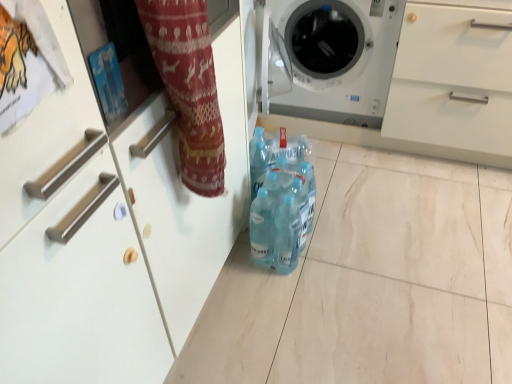
Find the location of a particular element. The height and width of the screenshot is (384, 512). white glossy washing machine at center is located at coordinates (332, 59).

What do you see at coordinates (332, 59) in the screenshot?
I see `white glossy washing machine at center` at bounding box center [332, 59].

What is the approximate height of white glossy washing machine at center?

The height of white glossy washing machine at center is 27.57 inches.

Measure the distance between white glossy washing machine at center and camera.

4.86 feet.

The height and width of the screenshot is (384, 512). What do you see at coordinates (282, 202) in the screenshot?
I see `blue plastic bottles at center` at bounding box center [282, 202].

Identify the location of blue plastic bottles at center. The width and height of the screenshot is (512, 384). (282, 202).

The width and height of the screenshot is (512, 384). What are the coordinates of `white glossy washing machine at center` in the screenshot? It's located at (332, 59).

Between white glossy washing machine at center and blue plastic bottles at center, which one appears on the left side from the viewer's perspective?

blue plastic bottles at center.

Between white glossy washing machine at center and blue plastic bottles at center, which one is positioned behind?

Positioned behind is white glossy washing machine at center.

Between point (297, 102) and point (273, 233), which one is positioned in front?

The point (273, 233) is closer to the camera.

From the image's perspective, is white glossy washing machine at center under blue plastic bottles at center?

No, from the image's perspective, white glossy washing machine at center is not below blue plastic bottles at center.

From a real-world perspective, is white glossy washing machine at center physically above blue plastic bottles at center?

Indeed, from a real-world perspective, white glossy washing machine at center stands above blue plastic bottles at center.

In the scene shown: Which object is thinner, white glossy washing machine at center or blue plastic bottles at center?

blue plastic bottles at center is thinner.

In terms of height, does white glossy washing machine at center look taller or shorter compared to blue plastic bottles at center?

Considering their sizes, white glossy washing machine at center has more height than blue plastic bottles at center.

Consider the image. Considering the sizes of objects white glossy washing machine at center and blue plastic bottles at center in the image provided, who is smaller, white glossy washing machine at center or blue plastic bottles at center?

blue plastic bottles at center.

Could blue plastic bottles at center be considered to be inside white glossy washing machine at center?

Definitely not — blue plastic bottles at center is not inside white glossy washing machine at center.

Is white glossy washing machine at center beside blue plastic bottles at center?

No, white glossy washing machine at center is not next to blue plastic bottles at center.

Is blue plastic bottles at center at the back of white glossy washing machine at center?

No, white glossy washing machine at center is not facing the opposite direction of blue plastic bottles at center.

How different are the orientations of white glossy washing machine at center and blue plastic bottles at center in degrees?

The angle between the facing direction of white glossy washing machine at center and the facing direction of blue plastic bottles at center is 85.5 degrees.

At what (x,y) coordinates should I click in order to perform the action: click on cleaning product in front of the white glossy washing machine at center. Please return your answer as a coordinate pair (x, y). This screenshot has width=512, height=384. Looking at the image, I should click on (282, 202).

Considering the positions of objects blue plastic bottles at center and white glossy washing machine at center in the image provided, who is more to the left, blue plastic bottles at center or white glossy washing machine at center?

Positioned to the left is blue plastic bottles at center.

Looking at this image, relative to white glossy washing machine at center, is blue plastic bottles at center in front or behind?

blue plastic bottles at center is positioned closer to the viewer than white glossy washing machine at center.

Is point (290, 254) in front of point (383, 42)?

Yes, it is.

From the image's perspective, would you say blue plastic bottles at center is shown under white glossy washing machine at center?

Yes, from the image's perspective, blue plastic bottles at center is beneath white glossy washing machine at center.

From a real-world perspective, is blue plastic bottles at center over white glossy washing machine at center?

No.

Considering the sizes of objects blue plastic bottles at center and white glossy washing machine at center in the image provided, who is thinner, blue plastic bottles at center or white glossy washing machine at center?

With smaller width is blue plastic bottles at center.

Considering the relative sizes of blue plastic bottles at center and white glossy washing machine at center in the image provided, is blue plastic bottles at center taller than white glossy washing machine at center?

No, blue plastic bottles at center is not taller than white glossy washing machine at center.

Which of these two, blue plastic bottles at center or white glossy washing machine at center, is smaller?

blue plastic bottles at center is smaller.

Is blue plastic bottles at center inside or outside of white glossy washing machine at center?

blue plastic bottles at center is not enclosed by white glossy washing machine at center.

Is blue plastic bottles at center next to white glossy washing machine at center?

blue plastic bottles at center is not next to white glossy washing machine at center, and they're not touching.

Is blue plastic bottles at center oriented towards white glossy washing machine at center?

No, blue plastic bottles at center is not turned towards white glossy washing machine at center.

How far apart are blue plastic bottles at center and white glossy washing machine at center?

blue plastic bottles at center is 18.51 inches from white glossy washing machine at center.

Find the location of `cleaning product on the left of white glossy washing machine at center`. cleaning product on the left of white glossy washing machine at center is located at coordinates (282, 202).

The height and width of the screenshot is (384, 512). Find the location of `cleaning product lying in front of the white glossy washing machine at center`. cleaning product lying in front of the white glossy washing machine at center is located at coordinates (282, 202).

In order to click on cleaning product to the left of white glossy washing machine at center in this screenshot , I will do `click(282, 202)`.